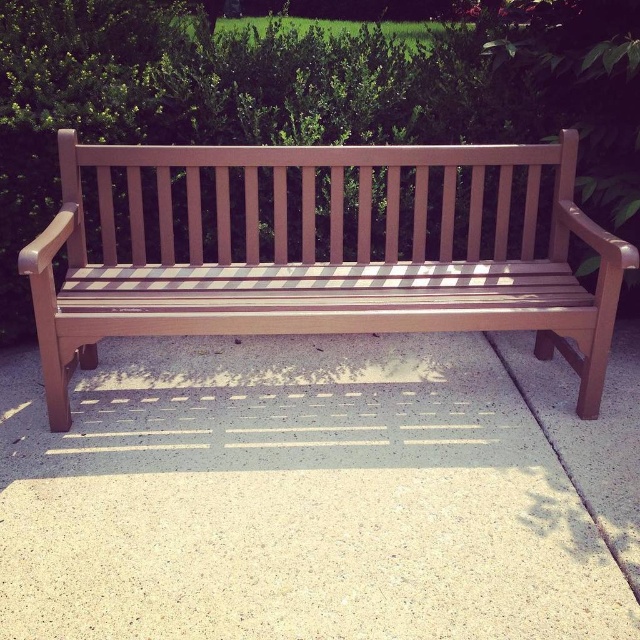
Does gray speckled concrete at center appear on the right side of teak wood bench at center?

Correct, you'll find gray speckled concrete at center to the right of teak wood bench at center.

Between point (3, 589) and point (497, 305), which one is positioned in front?

Point (3, 589) is more forward.

Is point (483, 477) closer to viewer compared to point (433, 172)?

Yes, it is.

Find the location of `gray speckled concrete at center`. gray speckled concrete at center is located at coordinates pos(321,492).